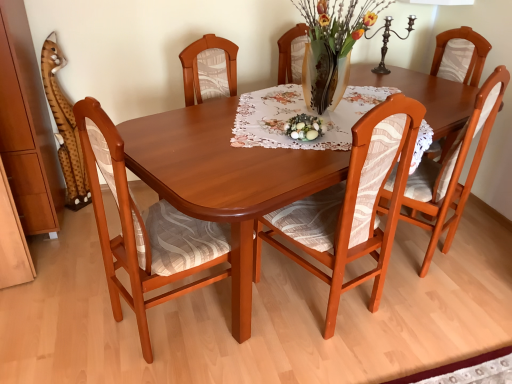
Identify the location of free location to the right of matte green glass bowl at center. pos(342,131).